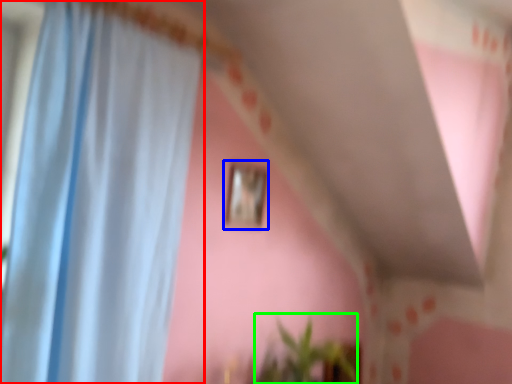
Question: Which object is positioned farthest from curtain (highlighted by a red box)? Select from picture frame (highlighted by a blue box) and plant (highlighted by a green box).

Choices:
 (A) picture frame
 (B) plant

Answer: (B)